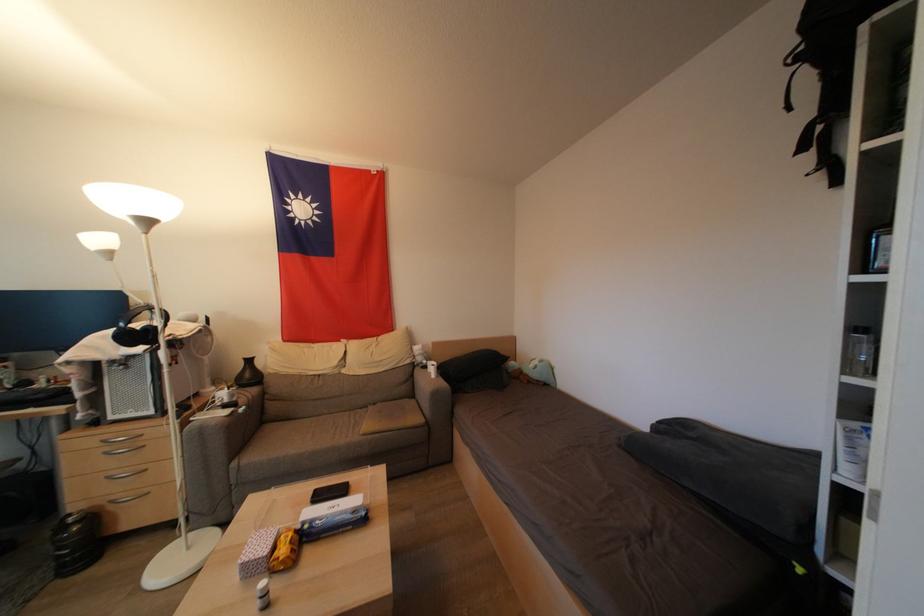
Describe the element at coordinates (862, 453) in the screenshot. I see `a paper tissue box` at that location.